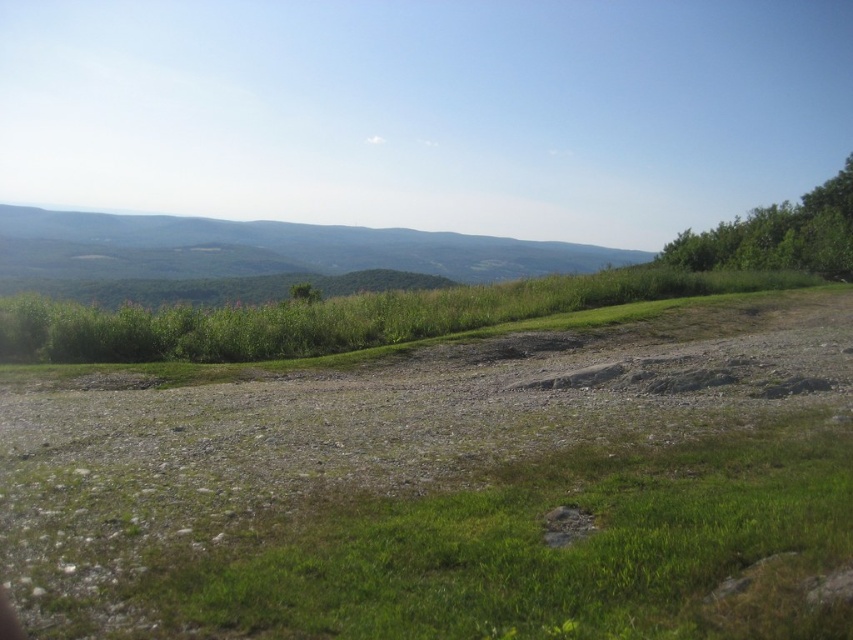
Question: Is green grassy hill at upper center smaller than green leafy tree at center?

Choices:
 (A) no
 (B) yes

Answer: (A)

Question: Which point appears farthest from the camera in this image?

Choices:
 (A) (407, 586)
 (B) (831, 227)

Answer: (B)

Question: Which point is closer to the camera taking this photo?

Choices:
 (A) (267, 372)
 (B) (309, 289)

Answer: (A)

Question: Does green grassy hill at upper center have a greater width compared to green leafy tree at upper right?

Choices:
 (A) no
 (B) yes

Answer: (B)

Question: Does dull gray gravel at center have a smaller size compared to green leafy tree at center?

Choices:
 (A) no
 (B) yes

Answer: (B)

Question: Which point is farther to the camera?

Choices:
 (A) green grassy hill at upper center
 (B) green leafy tree at center

Answer: (A)